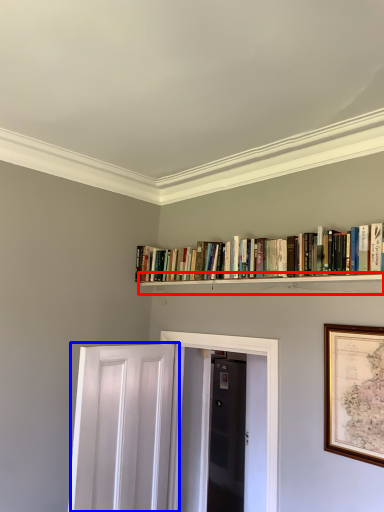
Question: Which point is further to the camera, shelf (highlighted by a red box) or door (highlighted by a blue box)?

Choices:
 (A) shelf
 (B) door

Answer: (B)